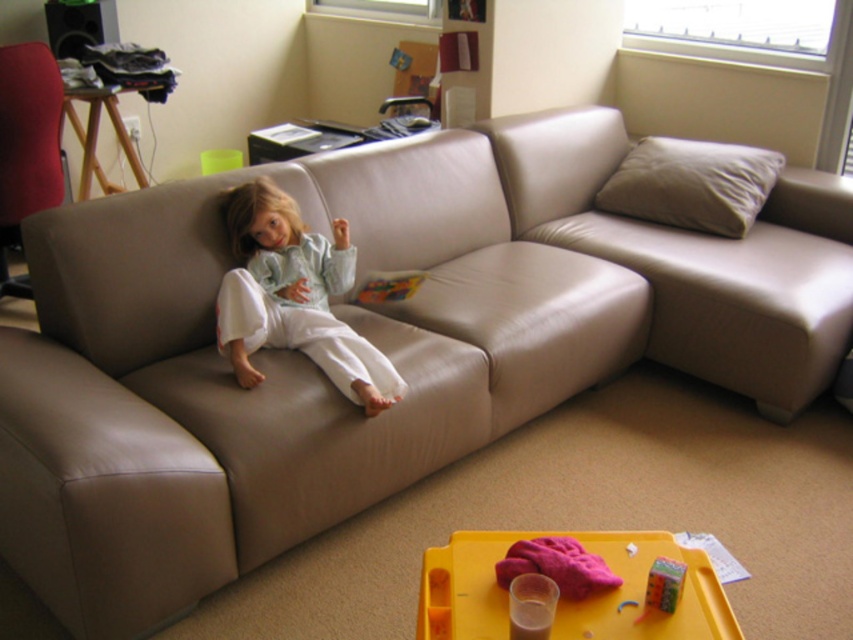
Which is more to the left, white cotton pants at center or yellow plastic tray at lower center?

Positioned to the left is white cotton pants at center.

Where is `white cotton pants at center`? This screenshot has height=640, width=853. white cotton pants at center is located at coordinates pos(294,298).

Consider the image. Who is more distant from viewer, (276, 342) or (676, 548)?

Point (276, 342)

Image resolution: width=853 pixels, height=640 pixels. Find the location of `white cotton pants at center`. white cotton pants at center is located at coordinates (294, 298).

Does point (386, 406) lie behind point (648, 204)?

No, (386, 406) is in front of (648, 204).

Is white cotton pants at center positioned behind suede-like beige pillow at upper right?

No, it is not.

Describe the element at coordinates (294, 298) in the screenshot. I see `white cotton pants at center` at that location.

Identify the location of white cotton pants at center. (294, 298).

Which is below, leather couch at center or white cotton pants at center?

Positioned lower is white cotton pants at center.

Find the location of `leather couch at center`. leather couch at center is located at coordinates (695, 259).

At what (x,y) coordinates should I click in order to perform the action: click on leather couch at center. Please return your answer as a coordinate pair (x, y). Looking at the image, I should click on (695, 259).